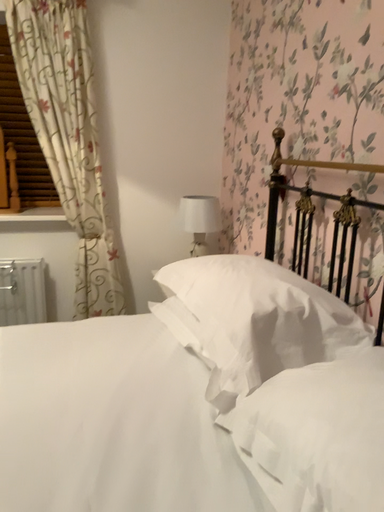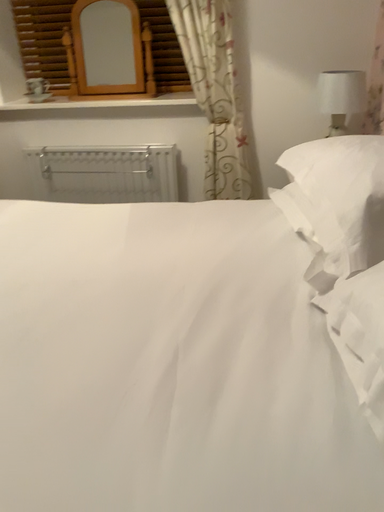
Question: How did the camera likely rotate when shooting the video?

Choices:
 (A) rotated right
 (B) rotated left

Answer: (B)